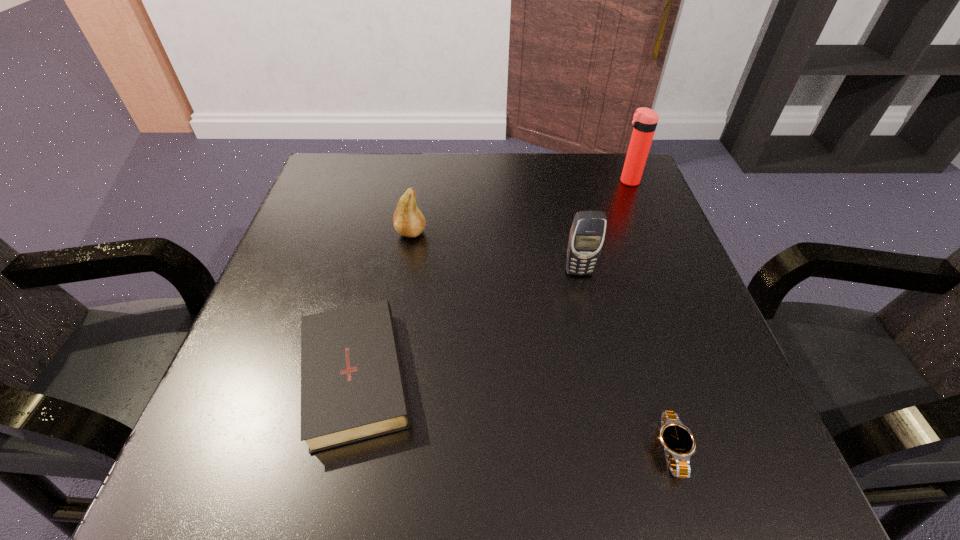
Where is `the farthest object`? the farthest object is located at coordinates (645, 120).

Identify the location of thermos bottle. Image resolution: width=960 pixels, height=540 pixels. point(645,120).

At what (x,y) coordinates should I click in order to perform the action: click on cellular telephone. Please return your answer as a coordinate pair (x, y). This screenshot has width=960, height=540. Looking at the image, I should click on (587, 234).

Locate an element on the screen. This screenshot has height=540, width=960. the fourth shortest object is located at coordinates (587, 234).

Where is `the second farthest object`? the second farthest object is located at coordinates (408, 220).

This screenshot has width=960, height=540. What are the coordinates of `pear` in the screenshot? It's located at (408, 220).

Where is `the fourth tallest object`? The image size is (960, 540). the fourth tallest object is located at coordinates (352, 387).

Where is `the shortest object`? the shortest object is located at coordinates (679, 443).

Identify the location of watch. This screenshot has height=540, width=960. (679, 443).

The height and width of the screenshot is (540, 960). What are the coordinates of `free space located 0.330m on the left of the rightmost object` in the screenshot? It's located at (486, 181).